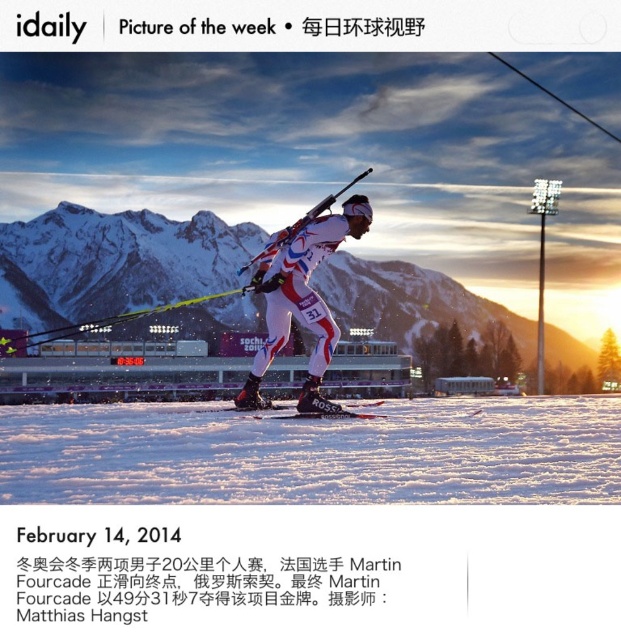
Which is behind, point (420, 282) or point (304, 312)?

The point (420, 282) is more distant.

Measure the distance between white snow-covered mountain at center and camera.

The distance of white snow-covered mountain at center from camera is 151.70 meters.

The width and height of the screenshot is (621, 640). Identify the location of white snow-covered mountain at center. (114, 260).

The width and height of the screenshot is (621, 640). Identify the location of white fluffy snow at lower center. (314, 452).

Does white fluffy snow at lower center appear under white snow-covered mountain at center?

Correct, white fluffy snow at lower center is located below white snow-covered mountain at center.

This screenshot has height=640, width=621. I want to click on white fluffy snow at lower center, so click(x=314, y=452).

Is white fluffy snow at lower center bigger than white matte ski suit at center?

Yes.

Does point (247, 476) lie behind point (332, 218)?

No, it is not.

Does point (296, 451) come closer to viewer compared to point (302, 248)?

Yes.

The width and height of the screenshot is (621, 640). Identify the location of white fluffy snow at lower center. (314, 452).